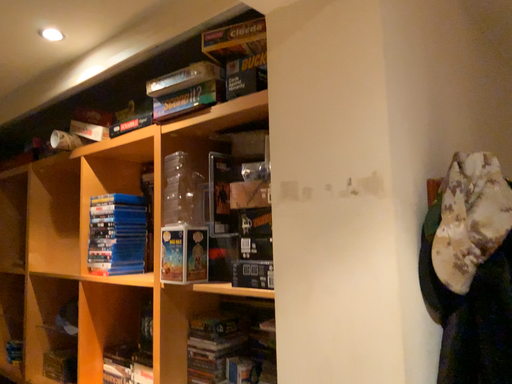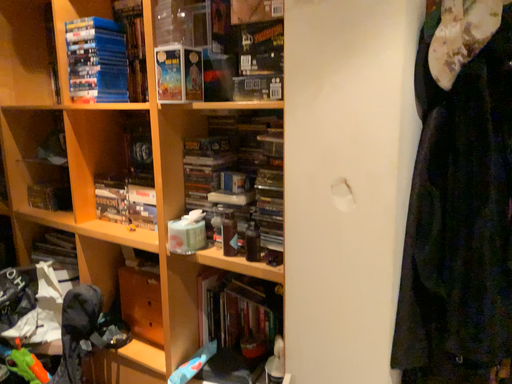
Question: Which way did the camera rotate in the video?

Choices:
 (A) rotated right
 (B) rotated left

Answer: (A)